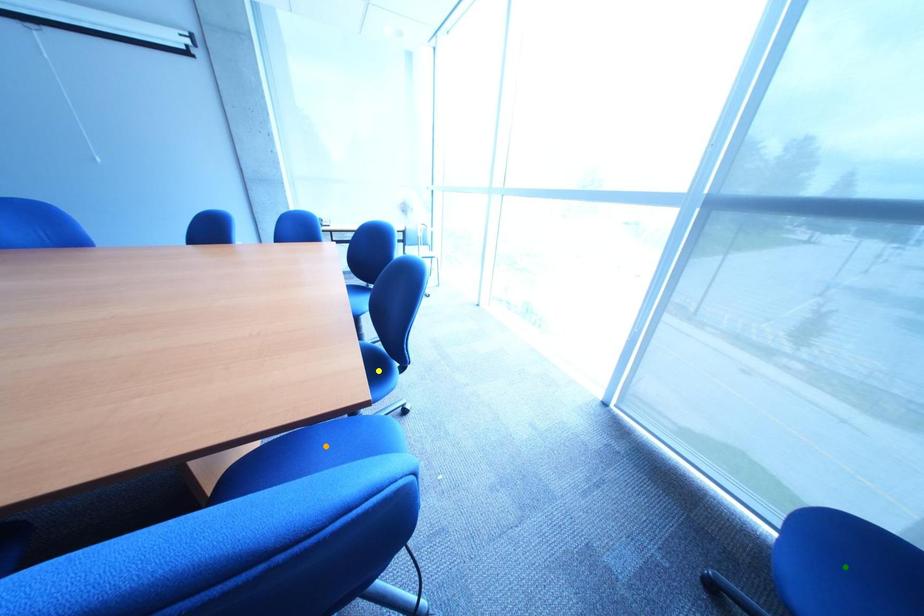
Order these from nearest to farthest:
1. yellow point
2. green point
3. orange point

green point → yellow point → orange point